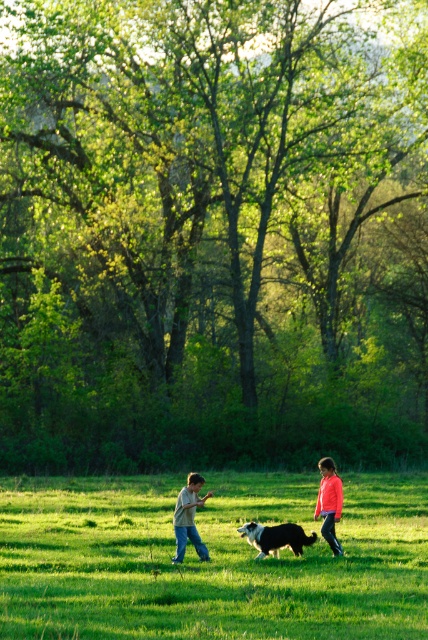
You are a photographer trying to capture a group photo of the two children wearing the light brown cotton shirt at center and the matte pink shirt at center. If you want to ensure both children appear the same size in the photo, what should you do?

To make both children appear the same size in the photo, the photographer should position the matte pink shirt at center closer to the camera and the light brown cotton shirt at center farther away since the light brown cotton shirt at center is wider and thus appears larger when at the same distance.